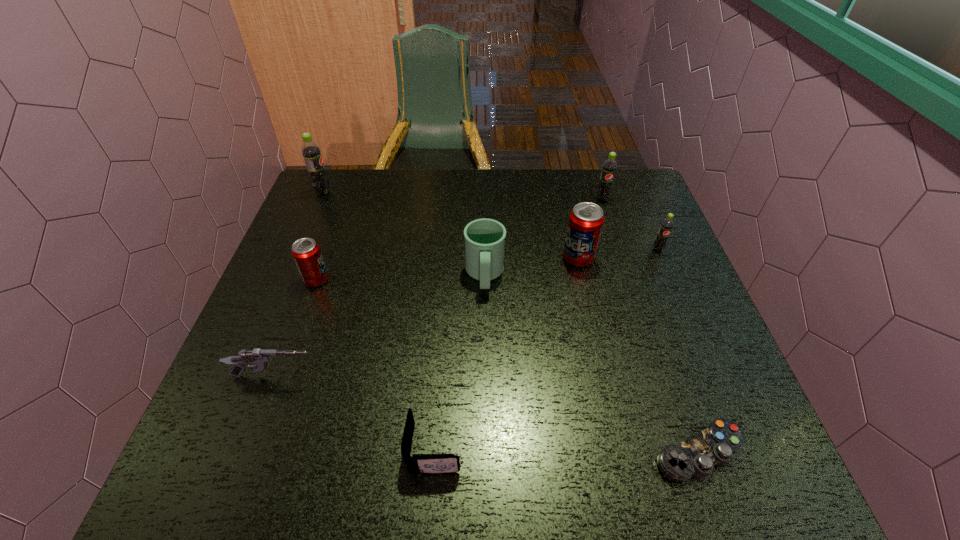
Identify the location of the nearest soda can. Image resolution: width=960 pixels, height=540 pixels. (306, 252).

Where is `the seventh farthest object`? the seventh farthest object is located at coordinates (260, 358).

You are a GUI agent. You are given a task and a screenshot of the screen. Output one action in this format:
    pyautogui.click(x=<x>, y=<y>)
    Task: Click on the seventh tallest object
    This screenshot has width=960, height=540.
    Given the screenshot: What is the action you would take?
    click(x=260, y=358)

The height and width of the screenshot is (540, 960). I want to click on the eighth tallest object, so click(417, 463).

Where is `control`? This screenshot has height=540, width=960. control is located at coordinates (698, 455).

Locate an element on the screen. vacant space situated 0.270m on the front label of the leftmost green soda is located at coordinates (420, 192).

You are a GUI agent. You are given a task and a screenshot of the screen. Output one action in this format:
    pyautogui.click(x=<x>, y=<y>)
    Task: Click on the free space located 0.100m on the front label of the second biggest green soda
    Image resolution: width=960 pixels, height=540 pixels.
    Given the screenshot: What is the action you would take?
    pyautogui.click(x=611, y=224)

The width and height of the screenshot is (960, 540). Find the location of `vacant space situated 0.280m on the left of the farther red soda can`. vacant space situated 0.280m on the left of the farther red soda can is located at coordinates (455, 258).

Where is `vacant space located 0.340m on the side of the green mug with the handle`? Image resolution: width=960 pixels, height=540 pixels. vacant space located 0.340m on the side of the green mug with the handle is located at coordinates click(x=487, y=434).

Image resolution: width=960 pixels, height=540 pixels. I want to click on free space located 0.320m on the front label of the smallest green soda, so click(x=702, y=355).